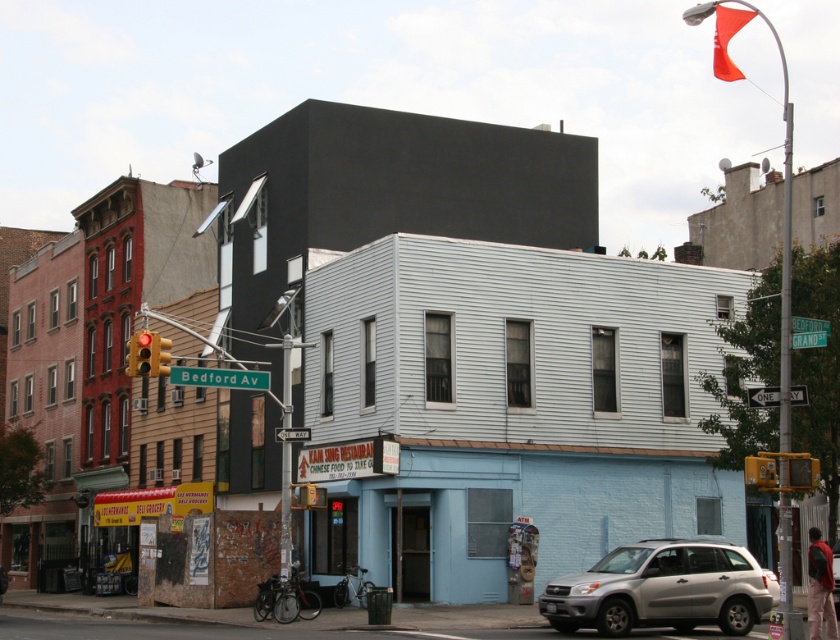
Who is taller, silver metallic suv at lower right or yellow metallic traffic light at left?

With more height is silver metallic suv at lower right.

Does point (621, 596) come behind point (169, 348)?

No, it is in front of (169, 348).

Identify the location of silver metallic suv at lower right. (660, 589).

Does silver metallic suv at lower right have a greater width compared to greenmaterial/texturestreet sign at upper center?

Yes, silver metallic suv at lower right is wider than greenmaterial/texturestreet sign at upper center.

Can you confirm if silver metallic suv at lower right is taller than greenmaterial/texturestreet sign at upper center?

Indeed, silver metallic suv at lower right has a greater height compared to greenmaterial/texturestreet sign at upper center.

Where is `silver metallic suv at lower right`? The image size is (840, 640). silver metallic suv at lower right is located at coordinates (660, 589).

This screenshot has height=640, width=840. In order to click on silver metallic suv at lower right in this screenshot , I will do `click(660, 589)`.

Measure the distance between point (156,376) and camera.

A distance of 24.18 meters exists between point (156,376) and camera.

Who is taller, red glass traffic light at left or yellow metallic traffic light at left?

Standing taller between the two is red glass traffic light at left.

Is point (147, 337) closer to camera compared to point (163, 369)?

Yes, it is.

At what (x,y) coordinates should I click in order to perform the action: click on red glass traffic light at left. Please return your answer as a coordinate pair (x, y). The width and height of the screenshot is (840, 640). Looking at the image, I should click on (147, 355).